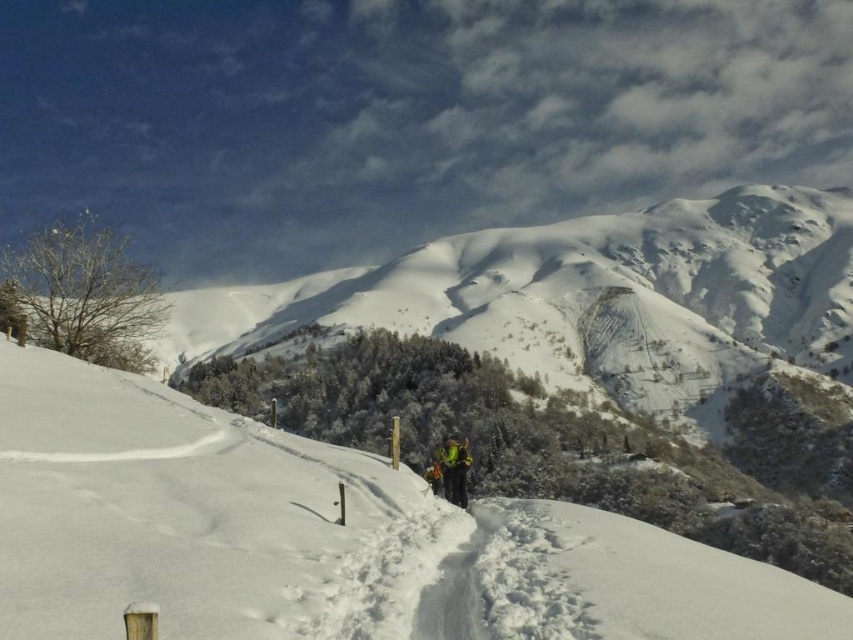
Between point (561, 596) and point (463, 476), which one is positioned behind?

The point (463, 476) is more distant.

Who is higher up, white snow ski slope at center or green fabric jacket at center?

white snow ski slope at center is higher up.

This screenshot has width=853, height=640. What are the coordinates of `white snow ski slope at center` in the screenshot? It's located at (322, 538).